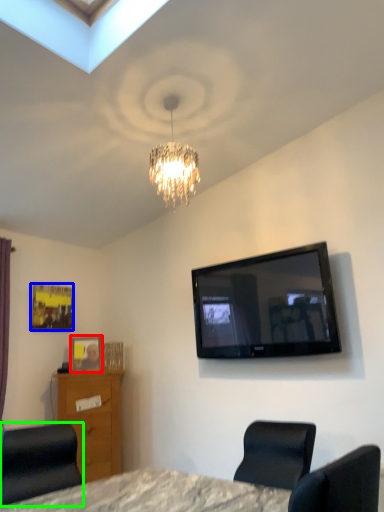
Question: Which is farther away from picture frame (highlighted by a red box)? picture frame (highlighted by a blue box) or chair (highlighted by a green box)?

Choices:
 (A) picture frame
 (B) chair

Answer: (B)